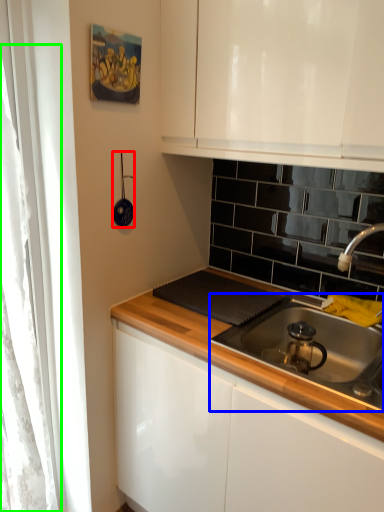
Question: Considering the real-world distances, which object is farthest from appliance (highlighted by a red box)? gas stove (highlighted by a blue box) or curtain (highlighted by a green box)?

Choices:
 (A) gas stove
 (B) curtain

Answer: (A)